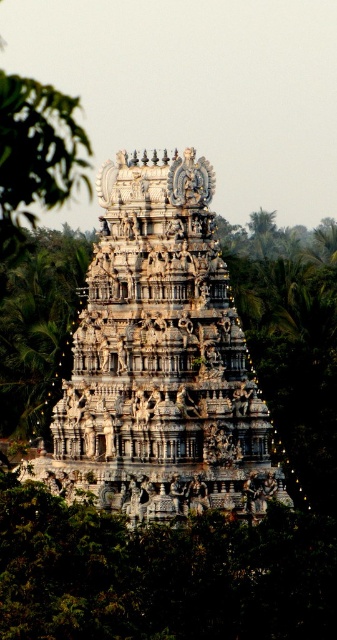
Question: Can you confirm if green leafy tree at center is positioned below green leafy tree at left?

Choices:
 (A) yes
 (B) no

Answer: (A)

Question: Does white stone hindu temple at center have a lesser width compared to green leafy tree at center?

Choices:
 (A) no
 (B) yes

Answer: (A)

Question: Which object is the farthest from the white stone hindu temple at center?

Choices:
 (A) green leafy tree at center
 (B) green leafy tree at left

Answer: (A)

Question: Considering the real-world distances, which object is farthest from the green leafy tree at center?

Choices:
 (A) white stone hindu temple at center
 (B) green leafy tree at left

Answer: (A)

Question: In this image, where is white stone hindu temple at center located relative to green leafy tree at left?

Choices:
 (A) below
 (B) above

Answer: (A)

Question: Which object is closer to the camera taking this photo?

Choices:
 (A) green leafy tree at center
 (B) white stone hindu temple at center

Answer: (B)